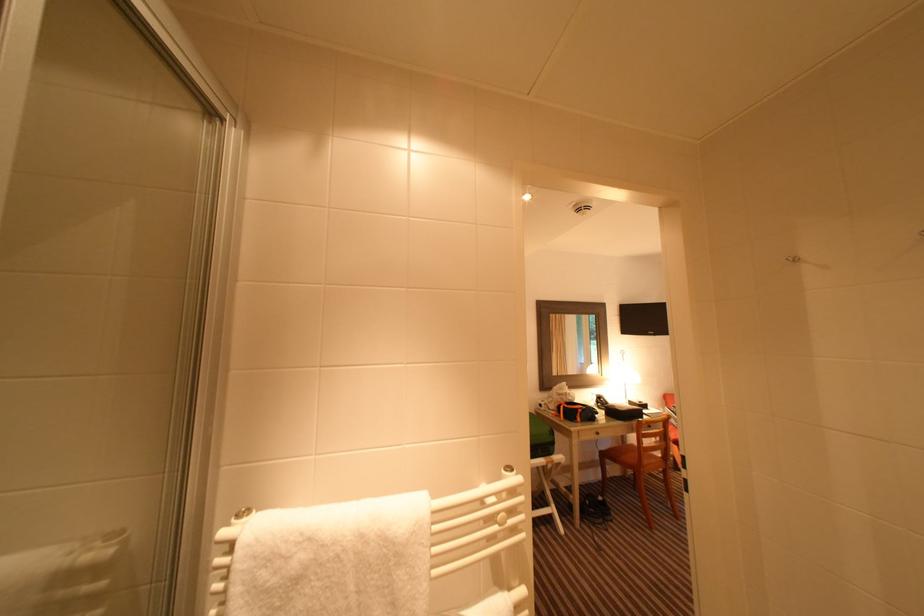
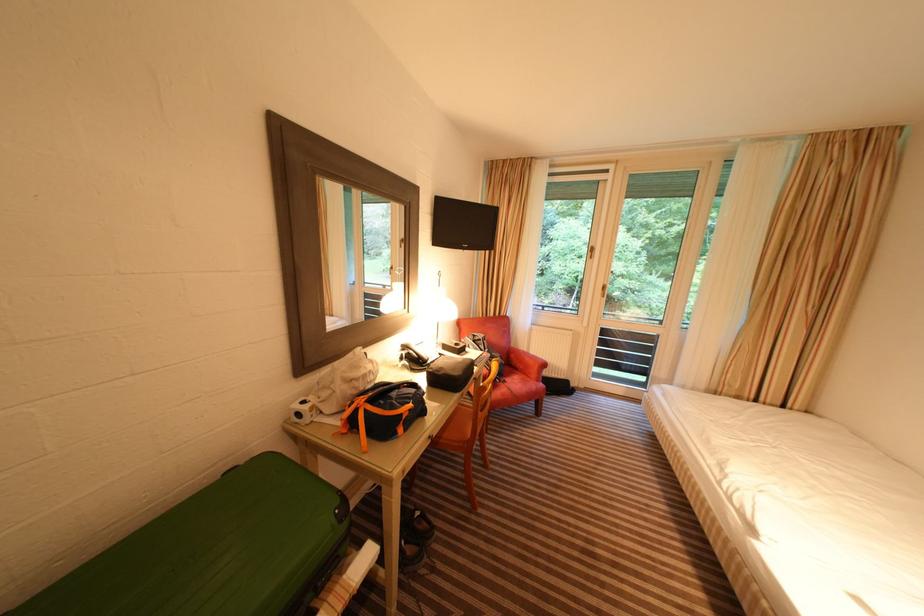
Find the pixel in the second image that matches [568,391] in the first image.

(361, 369)